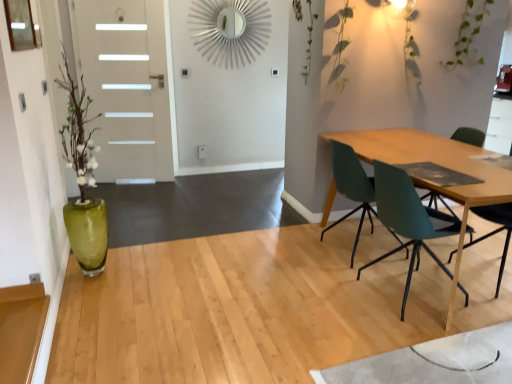
Question: From a real-world perspective, is teal matte chair at right, which is the first chair from back to front, over white glossy door at left?

Choices:
 (A) yes
 (B) no

Answer: (B)

Question: Is teal matte chair at right, the second chair positioned from the front, positioned behind white glossy door at left?

Choices:
 (A) no
 (B) yes

Answer: (A)

Question: From the image's perspective, does teal matte chair at right, which is the first chair from back to front, appear higher than white glossy door at left?

Choices:
 (A) no
 (B) yes

Answer: (A)

Question: Does teal matte chair at right, which is the first chair from back to front, have a greater width compared to white glossy door at left?

Choices:
 (A) no
 (B) yes

Answer: (B)

Question: Is teal matte chair at right, which is the first chair from back to front, not inside white glossy door at left?

Choices:
 (A) no
 (B) yes

Answer: (B)

Question: Based on their sizes in the image, would you say teal matte chair at right, the second chair positioned from the front, is bigger or smaller than teal plastic chair at right, the 2th chair in the back-to-front sequence?

Choices:
 (A) big
 (B) small

Answer: (B)

Question: From a real-world perspective, relative to teal plastic chair at right, the 2th chair in the back-to-front sequence, is teal matte chair at right, the second chair positioned from the front, vertically above or below?

Choices:
 (A) above
 (B) below

Answer: (B)

Question: Choose the correct answer: Is teal matte chair at right, which is the first chair from back to front, inside teal plastic chair at right, the 2th chair in the back-to-front sequence, or outside it?

Choices:
 (A) outside
 (B) inside

Answer: (A)

Question: From their relative heights in the image, would you say teal matte chair at right, the second chair positioned from the front, is taller or shorter than teal plastic chair at right, the 2th chair in the back-to-front sequence?

Choices:
 (A) tall
 (B) short

Answer: (B)

Question: From the image's perspective, is teal plastic chair at right, which is the 1th chair in front-to-back order, located above or below teal matte chair at right, the second chair positioned from the front?

Choices:
 (A) above
 (B) below

Answer: (B)

Question: Considering the positions of point (414, 195) and point (349, 173), is point (414, 195) closer or farther from the camera than point (349, 173)?

Choices:
 (A) closer
 (B) farther

Answer: (A)

Question: From a real-world perspective, is teal plastic chair at right, the 2th chair in the back-to-front sequence, positioned above or below teal matte chair at right, which is the first chair from back to front?

Choices:
 (A) below
 (B) above

Answer: (B)

Question: Do you think teal plastic chair at right, the 2th chair in the back-to-front sequence, is within teal matte chair at right, which is the first chair from back to front, or outside of it?

Choices:
 (A) outside
 (B) inside

Answer: (A)

Question: Relative to white glossy door at left, is teal plastic chair at right, which is the 1th chair in front-to-back order, in front or behind?

Choices:
 (A) front
 (B) behind

Answer: (A)

Question: Is teal plastic chair at right, which is the 1th chair in front-to-back order, to the left or to the right of white glossy door at left in the image?

Choices:
 (A) left
 (B) right

Answer: (B)